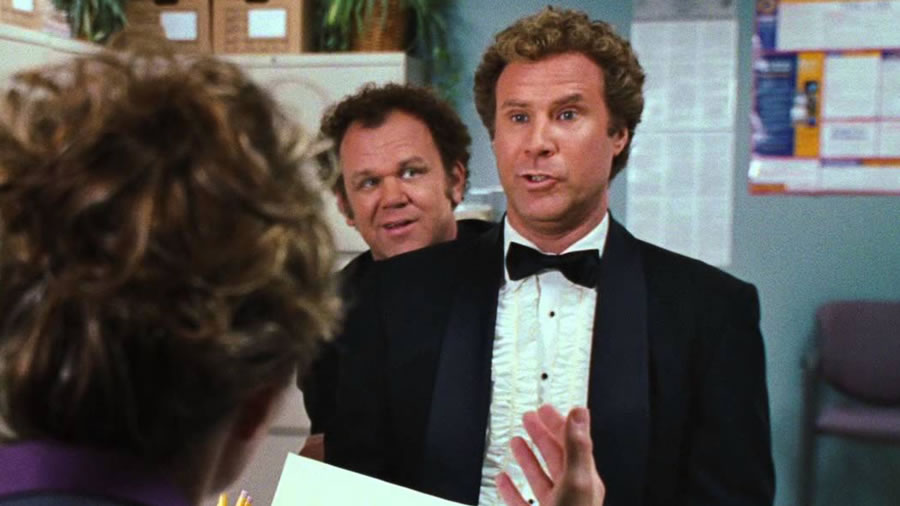
You are a GUI agent. You are given a task and a screenshot of the screen. Output one action in this format:
    pyautogui.click(x=<x>, y=<y>)
    Task: Click on the office plant on top of cabinets
    
    Given the screenshot: What is the action you would take?
    pyautogui.click(x=373, y=29)